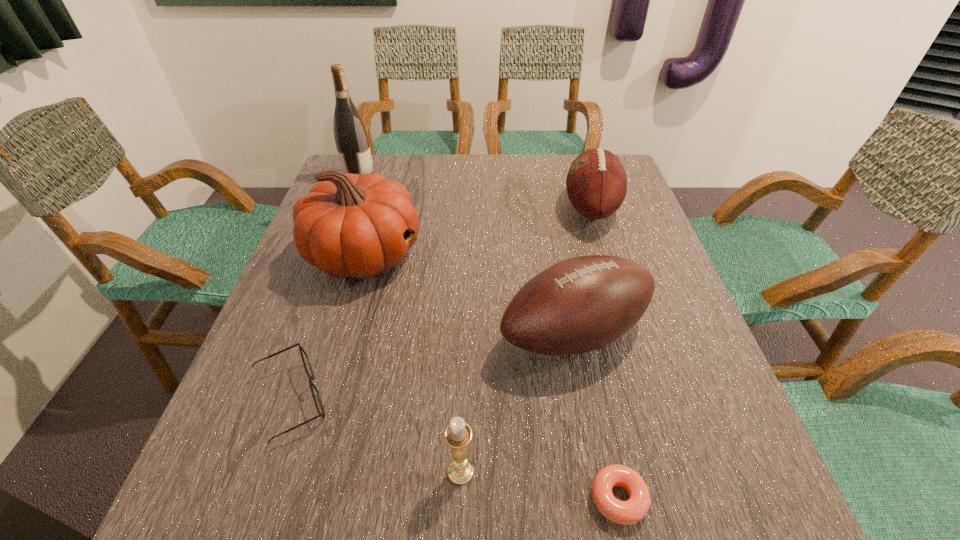
Image resolution: width=960 pixels, height=540 pixels. What are the coordinates of `wine bottle` in the screenshot? It's located at click(x=351, y=138).

Identify the location of the second tallest object. (350, 226).

Find the location of a particular element. The width and height of the screenshot is (960, 540). the nearer football (American) is located at coordinates (581, 304).

You are a GUI agent. You are given a task and a screenshot of the screen. Output one action in this format:
    pyautogui.click(x=<x>, y=<y>)
    Task: Click on the farther football (American)
    Image resolution: width=960 pixels, height=540 pixels.
    Given the screenshot: What is the action you would take?
    pyautogui.click(x=596, y=183)

Locate an element on the screen. The image size is (960, 540). candle holder is located at coordinates (458, 434).

This screenshot has height=540, width=960. In order to click on spectacles in this screenshot , I will do `click(316, 396)`.

At what (x,y) coordinates should I click in order to perform the action: click on doughnut. Please return your answer as a coordinate pair (x, y). Looking at the image, I should click on (628, 512).

Where is `vacant area situated 0.200m on the label of the tallest object`? The image size is (960, 540). vacant area situated 0.200m on the label of the tallest object is located at coordinates (441, 177).

Locate an element on the screen. The width and height of the screenshot is (960, 540). free point located on the face of the pumpkin is located at coordinates (446, 254).

In order to click on vacant space situated 0.170m on the left of the nearer football (American) in this screenshot , I will do `click(415, 334)`.